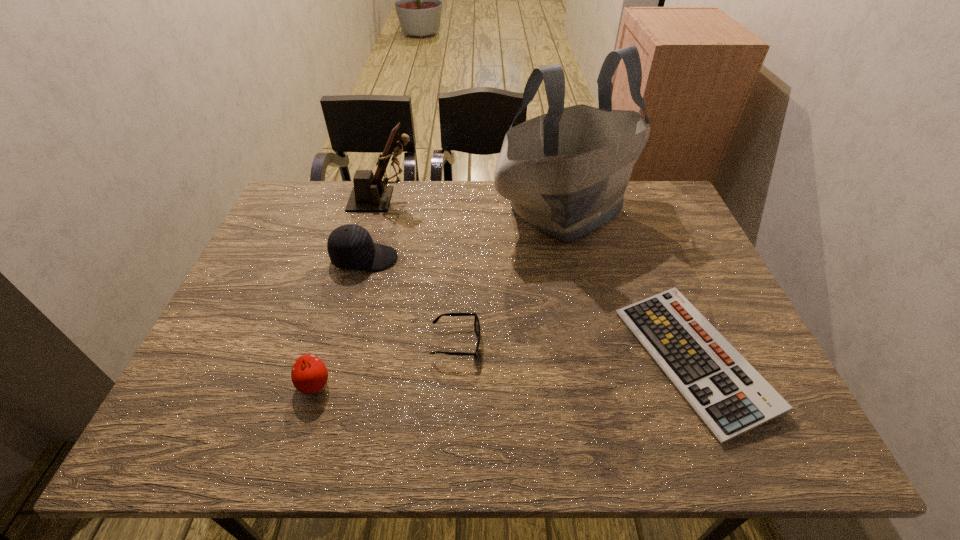
In order to click on free space that satisfies the following two spatial constraints: 1. on the front-facing side of the computer keyboard; 2. on the left side of the fifth shortest object in this screenshot , I will do `click(341, 360)`.

Locate an element on the screen. The width and height of the screenshot is (960, 540). free space that satisfies the following two spatial constraints: 1. on the front-facing side of the figurine; 2. on the back side of the shopping bag is located at coordinates (380, 210).

The image size is (960, 540). I want to click on vacant space that satisfies the following two spatial constraints: 1. on the front-facing side of the second shortest object; 2. on the front side of the third shortest object, so click(x=454, y=384).

At what (x,y) coordinates should I click in order to perform the action: click on vacant space that satisfies the following two spatial constraints: 1. at the front of the baseball cap where the brim is located; 2. on the front side of the apple. Please return your answer as a coordinate pair (x, y). The image size is (960, 540). Looking at the image, I should click on (330, 384).